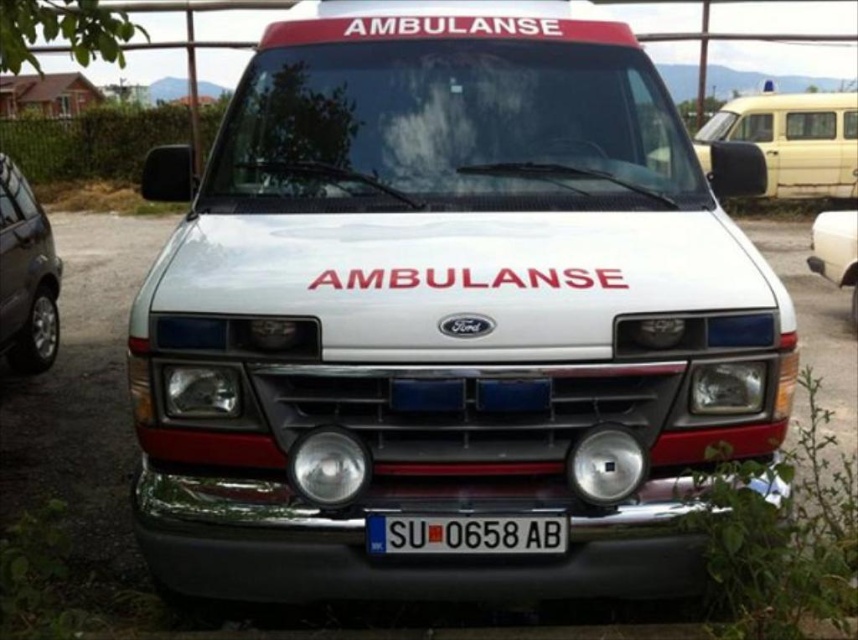
Who is higher up, yellow matte van at right or metallic gray car at left?

yellow matte van at right

Who is more forward, (768,150) or (0,285)?

Point (0,285)

Locate an element on the screen. The width and height of the screenshot is (858, 640). yellow matte van at right is located at coordinates (790, 140).

Is point (841, 134) behind point (846, 227)?

That is True.

Between point (801, 134) and point (819, 260), which one is positioned behind?

Point (801, 134)

Is point (820, 150) less distant than point (810, 262)?

No, it is behind (810, 262).

Locate an element on the screen. This screenshot has width=858, height=640. yellow matte van at right is located at coordinates click(x=790, y=140).

Which is below, metallic gray car at left or white plastic license plate at center?

Positioned lower is white plastic license plate at center.

Does point (13, 168) come closer to viewer compared to point (548, 547)?

No, it is behind (548, 547).

Is point (32, 324) more distant than point (458, 544)?

Yes, it is.

Identify the location of metallic gray car at left. (26, 275).